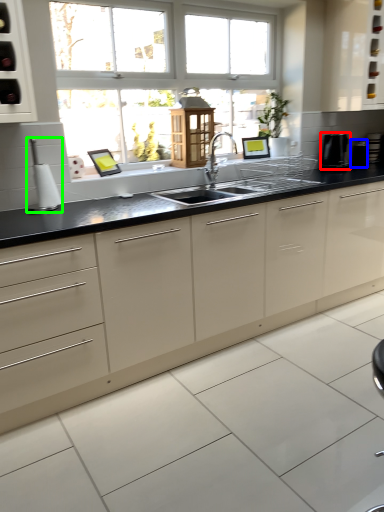
Question: Based on their relative distances, which object is farther from appliance (highlighted by a red box)? Choose from appliance (highlighted by a blue box) and appliance (highlighted by a green box).

Choices:
 (A) appliance
 (B) appliance

Answer: (B)